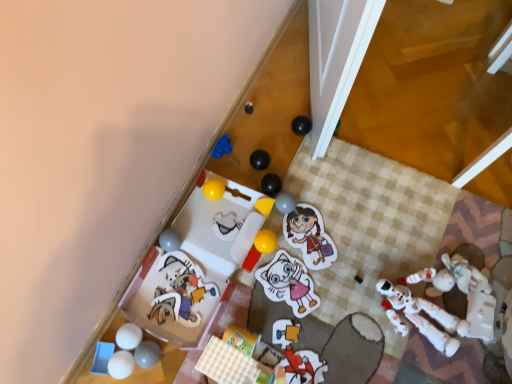
Where is `vacant area that is situated to the right of white matte cat at center, placed as the fourteenth toy when sorted from left to right`? vacant area that is situated to the right of white matte cat at center, placed as the fourteenth toy when sorted from left to right is located at coordinates (347, 296).